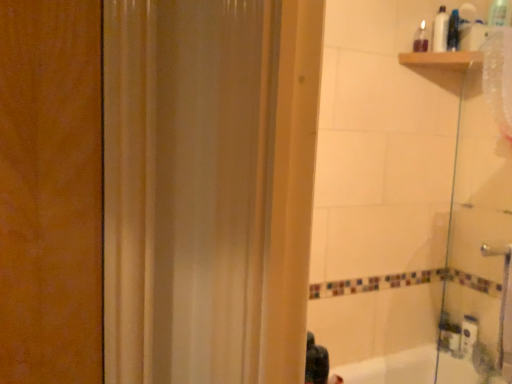
Question: From a real-world perspective, is transparent glass shower door at right located beneath black matte hair at lower center?

Choices:
 (A) no
 (B) yes

Answer: (A)

Question: Is transparent glass shower door at right facing away from black matte hair at lower center?

Choices:
 (A) yes
 (B) no

Answer: (B)

Question: Considering the relative positions of transparent glass shower door at right and black matte hair at lower center in the image provided, is transparent glass shower door at right in front of black matte hair at lower center?

Choices:
 (A) yes
 (B) no

Answer: (B)

Question: Is transparent glass shower door at right not near black matte hair at lower center?

Choices:
 (A) no
 (B) yes

Answer: (B)

Question: Considering the relative positions of transparent glass shower door at right and black matte hair at lower center in the image provided, is transparent glass shower door at right to the left of black matte hair at lower center from the viewer's perspective?

Choices:
 (A) no
 (B) yes

Answer: (A)

Question: Can we say transparent glass shower door at right lies outside black matte hair at lower center?

Choices:
 (A) no
 (B) yes

Answer: (B)

Question: Is the position of white plastic bottle at upper right, acting as the 2th toiletry starting from the right, less distant than that of translucent plastic bottle at upper right, the first toiletry positioned from the left?

Choices:
 (A) yes
 (B) no

Answer: (B)

Question: Considering the relative sizes of white plastic bottle at upper right, acting as the 2th toiletry starting from the right, and translucent plastic bottle at upper right, the first toiletry positioned from the left, in the image provided, is white plastic bottle at upper right, acting as the 2th toiletry starting from the right, shorter than translucent plastic bottle at upper right, the first toiletry positioned from the left,?

Choices:
 (A) no
 (B) yes

Answer: (A)

Question: Would you consider white plastic bottle at upper right, acting as the 2th toiletry starting from the right, to be distant from translucent plastic bottle at upper right, positioned as the 3th toiletry in right-to-left order?

Choices:
 (A) yes
 (B) no

Answer: (B)

Question: Considering the relative sizes of white plastic bottle at upper right, the second toiletry when ordered from left to right, and translucent plastic bottle at upper right, the first toiletry positioned from the left, in the image provided, is white plastic bottle at upper right, the second toiletry when ordered from left to right, taller than translucent plastic bottle at upper right, the first toiletry positioned from the left,?

Choices:
 (A) yes
 (B) no

Answer: (A)

Question: From a real-world perspective, is white plastic bottle at upper right, acting as the 2th toiletry starting from the right, on top of translucent plastic bottle at upper right, positioned as the 3th toiletry in right-to-left order?

Choices:
 (A) no
 (B) yes

Answer: (B)

Question: Can you confirm if white plastic bottle at upper right, acting as the 2th toiletry starting from the right, is thinner than translucent plastic bottle at upper right, the first toiletry positioned from the left?

Choices:
 (A) yes
 (B) no

Answer: (A)

Question: From the image's perspective, does white plastic bottle at upper right, acting as the 2th toiletry starting from the right, appear lower than translucent plastic bottle at upper right, positioned as the third toiletry in left-to-right order?

Choices:
 (A) yes
 (B) no

Answer: (B)